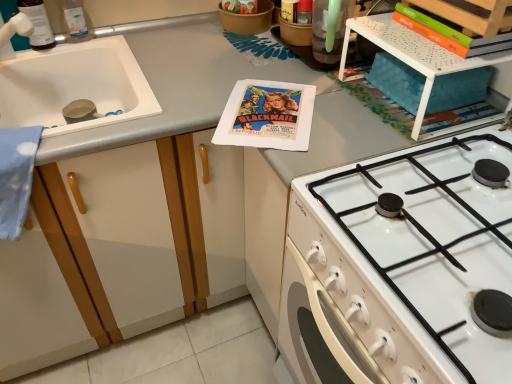
This screenshot has height=384, width=512. What are the coordinates of `vacant space to the left of orange matte book at upper right` in the screenshot? It's located at (389, 33).